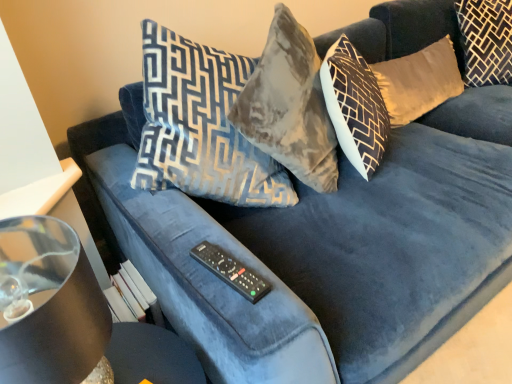
Question: Is shiny black lampshade at left surrounding black plastic remote at center?

Choices:
 (A) yes
 (B) no

Answer: (B)

Question: Is shiny black lampshade at left closer to the viewer compared to black plastic remote at center?

Choices:
 (A) yes
 (B) no

Answer: (A)

Question: Does shiny black lampshade at left have a lesser width compared to black plastic remote at center?

Choices:
 (A) no
 (B) yes

Answer: (A)

Question: Can you confirm if shiny black lampshade at left is taller than black plastic remote at center?

Choices:
 (A) yes
 (B) no

Answer: (A)

Question: From the image's perspective, is shiny black lampshade at left located beneath black plastic remote at center?

Choices:
 (A) yes
 (B) no

Answer: (A)

Question: Can we say shiny black lampshade at left lies outside black plastic remote at center?

Choices:
 (A) no
 (B) yes

Answer: (B)

Question: Is transparent glass table at lower left shorter than shiny black lampshade at left?

Choices:
 (A) no
 (B) yes

Answer: (A)

Question: Does transparent glass table at lower left have a smaller size compared to shiny black lampshade at left?

Choices:
 (A) yes
 (B) no

Answer: (A)

Question: Are transparent glass table at lower left and shiny black lampshade at left making contact?

Choices:
 (A) yes
 (B) no

Answer: (B)

Question: Is the position of transparent glass table at lower left less distant than that of shiny black lampshade at left?

Choices:
 (A) yes
 (B) no

Answer: (B)

Question: Considering the relative positions of transparent glass table at lower left and shiny black lampshade at left in the image provided, is transparent glass table at lower left to the right of shiny black lampshade at left from the viewer's perspective?

Choices:
 (A) no
 (B) yes

Answer: (B)

Question: Is transparent glass table at lower left bigger than shiny black lampshade at left?

Choices:
 (A) yes
 (B) no

Answer: (B)

Question: Is black plastic remote at center directly adjacent to velvet gold pillow at upper right, placed as the 2th pillow when sorted from right to left?

Choices:
 (A) yes
 (B) no

Answer: (B)